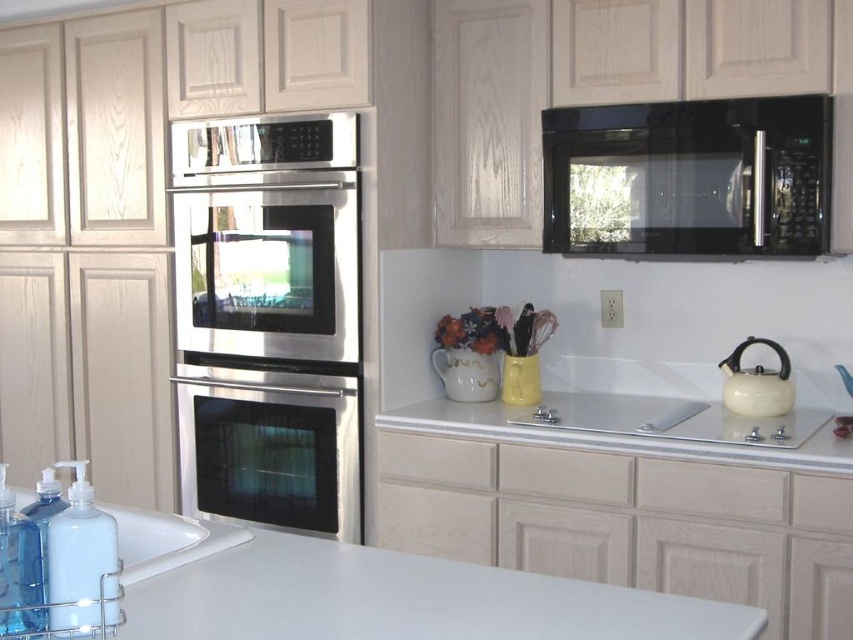
You are a kitchen designer planning to place a new appliance between the stainless steel oven at center and the white matte tea kettle at right. Given their sizes, which appliance should be placed closer to the edge of the countertop to ensure stability?

The stainless steel oven at center is larger than the white matte tea kettle at right, so the tea kettle should be placed closer to the edge of the countertop to maintain stability, as heavier or larger items are typically positioned further back.